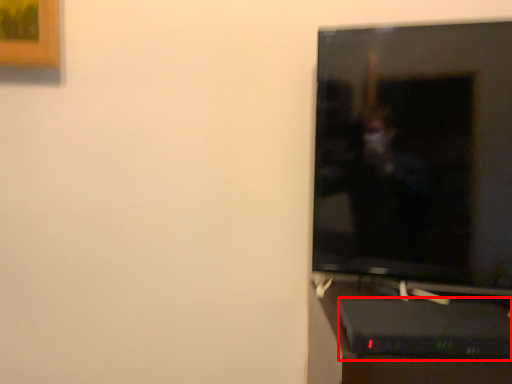
Question: Considering the relative positions of computer desk (annotated by the red box) and television in the image provided, where is computer desk (annotated by the red box) located with respect to the staircase?

Choices:
 (A) right
 (B) left

Answer: (B)